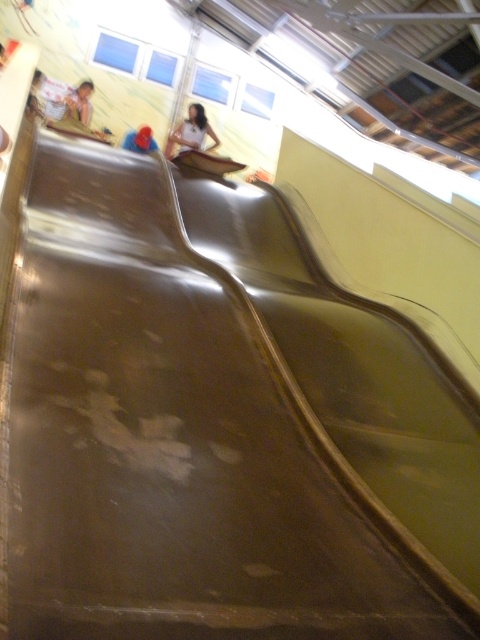
Image resolution: width=480 pixels, height=640 pixels. I want to click on smooth white shirt at upper center, so click(192, 131).

Is point (173, 144) positioned in front of point (151, 148)?

No, (173, 144) is behind (151, 148).

Image resolution: width=480 pixels, height=640 pixels. In order to click on smooth white shirt at upper center in this screenshot , I will do `click(192, 131)`.

Is smooth skin person at upper left further to the viewer compared to blue fabric at upper center?

Yes, it is behind blue fabric at upper center.

Is point (86, 93) positioned behind point (147, 150)?

Yes, it is behind point (147, 150).

The width and height of the screenshot is (480, 640). In order to click on smooth skin person at upper left in this screenshot , I will do (79, 104).

Is smooth white shirt at upper center to the right of smooth skin person at upper left from the viewer's perspective?

Yes, smooth white shirt at upper center is to the right of smooth skin person at upper left.

Between smooth white shirt at upper center and smooth skin person at upper left, which one has more height?

smooth skin person at upper left is taller.

Which is in front, point (192, 106) or point (75, 100)?

Point (192, 106) is in front.

Locate an element on the screen. smooth white shirt at upper center is located at coordinates (192, 131).